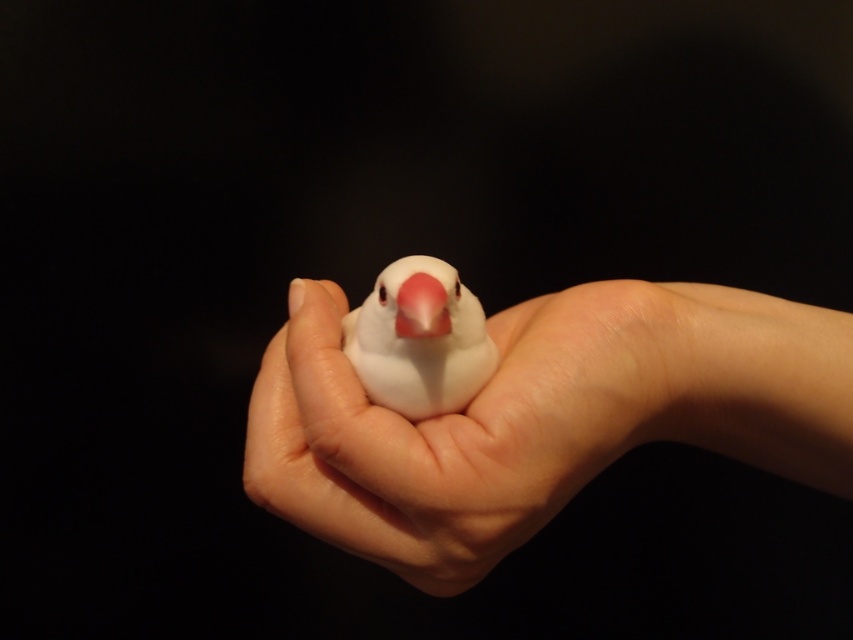
Question: Is smooth skin hand at center bigger than white matte bird at center?

Choices:
 (A) yes
 (B) no

Answer: (A)

Question: Can you confirm if smooth skin hand at center is positioned above pink matte beak at center?

Choices:
 (A) no
 (B) yes

Answer: (A)

Question: Based on their relative distances, which object is farther from the smooth skin hand at center?

Choices:
 (A) white matte bird at center
 (B) pink matte beak at center

Answer: (B)

Question: Can you confirm if white matte bird at center is wider than pink matte beak at center?

Choices:
 (A) yes
 (B) no

Answer: (A)

Question: Which of these objects is positioned closest to the smooth skin hand at center?

Choices:
 (A) pink matte beak at center
 (B) white matte bird at center

Answer: (B)

Question: Which of the following is the farthest from the observer?

Choices:
 (A) (366, 352)
 (B) (537, 385)
 (C) (397, 307)

Answer: (A)